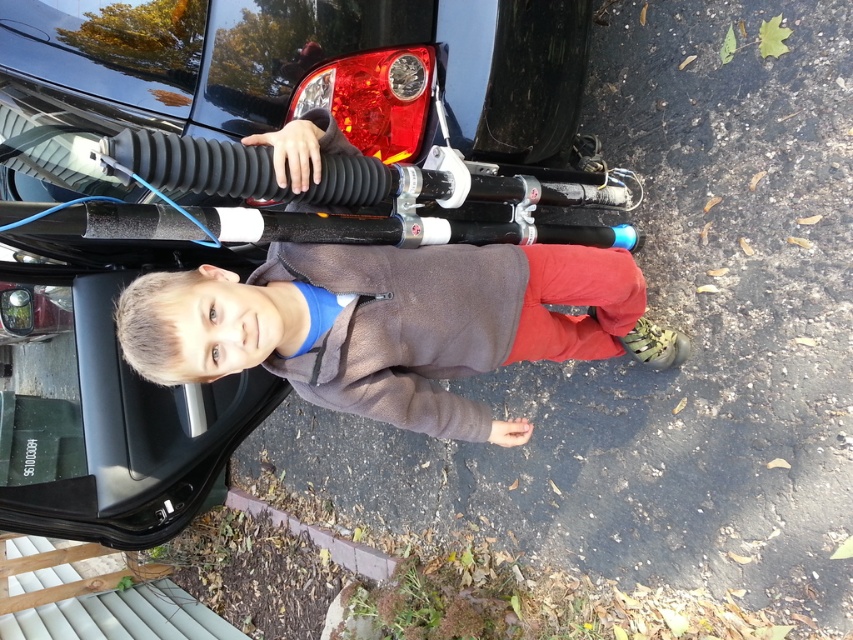
Question: Which is farther from the brown fleece jacket at center?

Choices:
 (A) black rubber tire at upper center
 (B) glossy black car at upper left

Answer: (A)

Question: Estimate the real-world distances between objects in this image. Which object is farther from the brown fleece jacket at center?

Choices:
 (A) glossy black car at upper left
 (B) black rubber tire at upper center

Answer: (B)

Question: Is glossy black car at upper left below brown fleece jacket at center?

Choices:
 (A) yes
 (B) no

Answer: (B)

Question: Can you confirm if glossy black car at upper left is smaller than brown fleece jacket at center?

Choices:
 (A) no
 (B) yes

Answer: (A)

Question: Can you confirm if glossy black car at upper left is wider than brown fleece jacket at center?

Choices:
 (A) no
 (B) yes

Answer: (B)

Question: Which of the following is the farthest from the observer?

Choices:
 (A) (410, 342)
 (B) (538, 163)

Answer: (B)